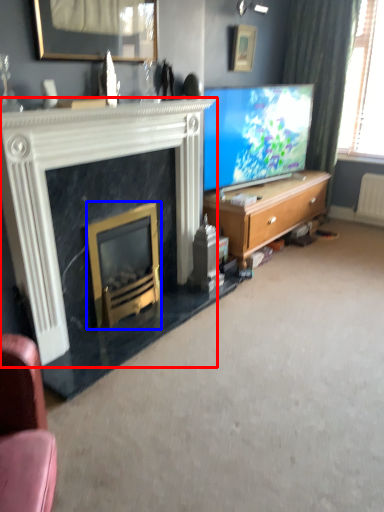
Question: Which point is closer to the camera, fireplace (highlighted by a red box) or fireplace (highlighted by a blue box)?

Choices:
 (A) fireplace
 (B) fireplace

Answer: (A)